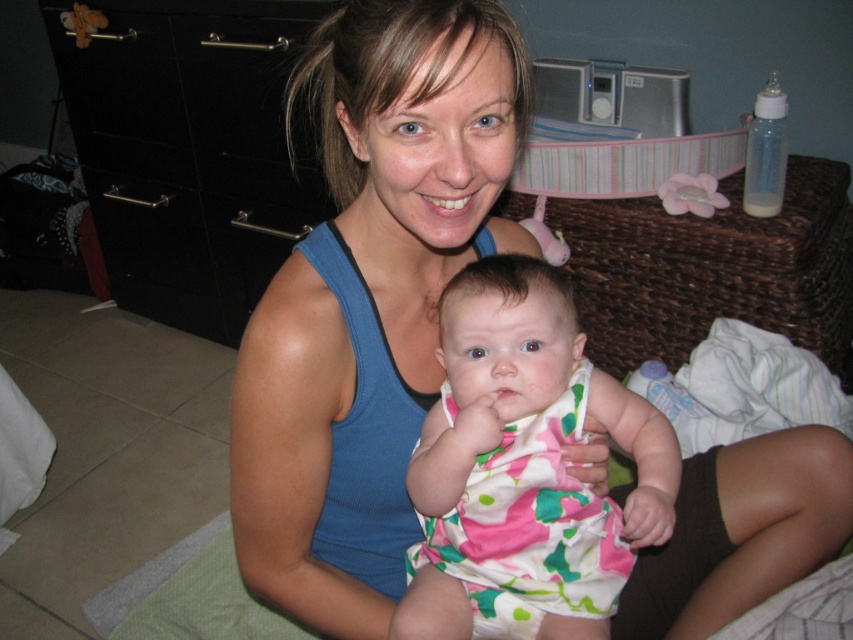
Which is above, black glossy dresser at left or floral fabric dress at center?

black glossy dresser at left

Does black glossy dresser at left have a lesser width compared to floral fabric dress at center?

Incorrect, black glossy dresser at left's width is not less than floral fabric dress at center's.

The image size is (853, 640). What do you see at coordinates (190, 150) in the screenshot?
I see `black glossy dresser at left` at bounding box center [190, 150].

Locate an element on the screen. black glossy dresser at left is located at coordinates (190, 150).

Which of these two, blue fabric tank top at center or black glossy dresser at left, stands taller?

With more height is black glossy dresser at left.

Does blue fabric tank top at center have a greater width compared to black glossy dresser at left?

No.

Between point (403, 497) and point (234, 150), which one is positioned in front?

Point (403, 497)

Find the location of `blue fabric tank top at center`. blue fabric tank top at center is located at coordinates [x=370, y=300].

Locate an element on the screen. blue fabric tank top at center is located at coordinates (370, 300).

Between blue fabric tank top at center and floral fabric dress at center, which one appears on the left side from the viewer's perspective?

Positioned to the left is blue fabric tank top at center.

Describe the element at coordinates (370, 300) in the screenshot. The width and height of the screenshot is (853, 640). I see `blue fabric tank top at center` at that location.

The image size is (853, 640). Identify the location of blue fabric tank top at center. (370, 300).